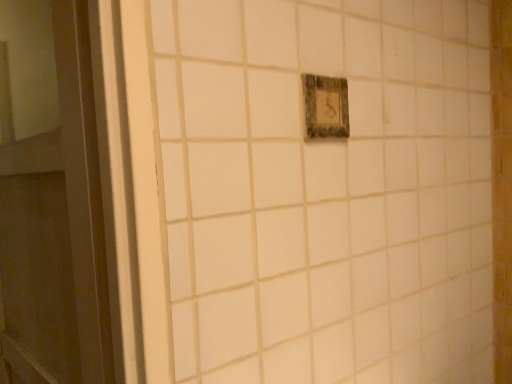
You are a GUI agent. You are given a task and a screenshot of the screen. Output one action in this format:
    pyautogui.click(x=<x>, y=<y>)
    Task: Click on the white glossy door at left
    Image resolution: width=512 pixels, height=384 pixels.
    Given the screenshot: What is the action you would take?
    (51, 200)

In order to face white glossy door at left, should I rotate leftwards or rightwards?

Turn left by 26.950 degrees to look at white glossy door at left.

Describe the element at coordinates (51, 200) in the screenshot. I see `white glossy door at left` at that location.

Describe the element at coordinates (326, 106) in the screenshot. I see `rustic wood light switch at center` at that location.

Image resolution: width=512 pixels, height=384 pixels. What are the coordinates of `rustic wood light switch at center` in the screenshot? It's located at (326, 106).

Where is `white glossy door at left`? Image resolution: width=512 pixels, height=384 pixels. white glossy door at left is located at coordinates (51, 200).

In the image, is rustic wood light switch at center on the left side or the right side of white glossy door at left?

Based on their positions, rustic wood light switch at center is located to the right of white glossy door at left.

Is the position of rustic wood light switch at center less distant than that of white glossy door at left?

No, it is behind white glossy door at left.

Is point (337, 106) closer to camera compared to point (32, 160)?

Yes, point (337, 106) is in front of point (32, 160).

From the image's perspective, is rustic wood light switch at center positioned above or below white glossy door at left?

Clearly, from the image's perspective, rustic wood light switch at center is above white glossy door at left.

From the picture: From a real-world perspective, is rustic wood light switch at center on white glossy door at left?

Yes, from a real-world perspective, rustic wood light switch at center is above white glossy door at left.

Considering the sizes of objects rustic wood light switch at center and white glossy door at left in the image provided, who is wider, rustic wood light switch at center or white glossy door at left?

Wider between the two is white glossy door at left.

Who is shorter, rustic wood light switch at center or white glossy door at left?

rustic wood light switch at center.

In terms of size, does rustic wood light switch at center appear bigger or smaller than white glossy door at left?

In the image, rustic wood light switch at center appears to be smaller than white glossy door at left.

Is rustic wood light switch at center not within white glossy door at left?

rustic wood light switch at center is positioned outside white glossy door at left.

Is rustic wood light switch at center not close to white glossy door at left?

Actually, rustic wood light switch at center and white glossy door at left are a little close together.

Is rustic wood light switch at center aimed at white glossy door at left?

No, rustic wood light switch at center is not turned towards white glossy door at left.

How different are the orientations of rustic wood light switch at center and white glossy door at left in degrees?

The angle between the facing direction of rustic wood light switch at center and the facing direction of white glossy door at left is 82.4 degrees.

The image size is (512, 384). I want to click on light switch on the right side of white glossy door at left, so click(326, 106).

Looking at this image, is white glossy door at left to the left of rustic wood light switch at center from the viewer's perspective?

Yes, white glossy door at left is to the left of rustic wood light switch at center.

Between white glossy door at left and rustic wood light switch at center, which one is positioned in front?

white glossy door at left is in front.

Does point (76, 302) lie behind point (323, 80)?

Yes, it is.

From the image's perspective, is white glossy door at left located beneath rustic wood light switch at center?

Yes, from the image's perspective, white glossy door at left is below rustic wood light switch at center.

From a real-world perspective, who is located lower, white glossy door at left or rustic wood light switch at center?

white glossy door at left, from a real-world perspective.

Which object is wider, white glossy door at left or rustic wood light switch at center?

Wider between the two is white glossy door at left.

Does white glossy door at left have a greater height compared to rustic wood light switch at center?

Indeed, white glossy door at left has a greater height compared to rustic wood light switch at center.

Considering the sizes of objects white glossy door at left and rustic wood light switch at center in the image provided, who is smaller, white glossy door at left or rustic wood light switch at center?

rustic wood light switch at center is smaller.

Is rustic wood light switch at center completely or partially inside white glossy door at left?

No, white glossy door at left does not contain rustic wood light switch at center.

Is there a large distance between white glossy door at left and rustic wood light switch at center?

They are positioned close to each other.

Is white glossy door at left aimed at rustic wood light switch at center?

No, white glossy door at left is not aimed at rustic wood light switch at center.

How distant is white glossy door at left from rustic wood light switch at center?

white glossy door at left is 53.52 centimeters away from rustic wood light switch at center.

This screenshot has width=512, height=384. In order to click on light switch that is above the white glossy door at left (from a real-world perspective) in this screenshot , I will do `click(326, 106)`.

Locate an element on the screen. The image size is (512, 384). door lying on the left of rustic wood light switch at center is located at coordinates (51, 200).

This screenshot has width=512, height=384. What are the coordinates of `light switch positioned vertically above the white glossy door at left (from a real-world perspective)` in the screenshot? It's located at (326, 106).